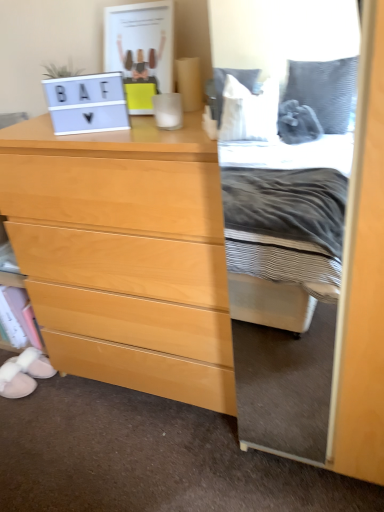
Question: From the image's perspective, is light wood chest of drawers at left above or below matte white laptop at upper left?

Choices:
 (A) above
 (B) below

Answer: (B)

Question: In the image, is light wood chest of drawers at left positioned in front of or behind matte white laptop at upper left?

Choices:
 (A) front
 (B) behind

Answer: (A)

Question: Which is nearer to the white suede slipper at lower left, which is the second shoe from back to front?

Choices:
 (A) white fluffy slippers at lower left, positioned as the first shoe in back-to-front order
 (B) light wood chest of drawers at left
 (C) matte white laptop at upper left

Answer: (A)

Question: Based on their relative distances, which object is nearer to the white suede slipper at lower left, acting as the first shoe starting from the front?

Choices:
 (A) light wood chest of drawers at left
 (B) matte white laptop at upper left
 (C) white fluffy slippers at lower left, acting as the 2th shoe starting from the front

Answer: (C)